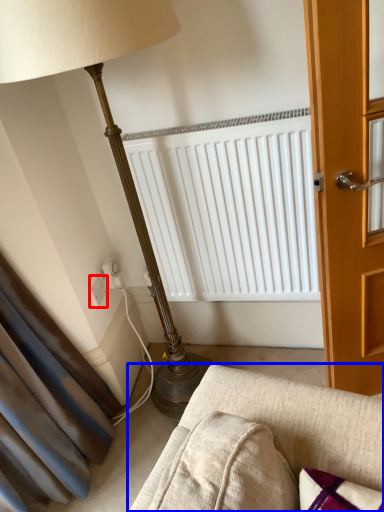
Question: Which object is further to the camera taking this photo, electric outlet (highlighted by a red box) or studio couch (highlighted by a blue box)?

Choices:
 (A) electric outlet
 (B) studio couch

Answer: (A)